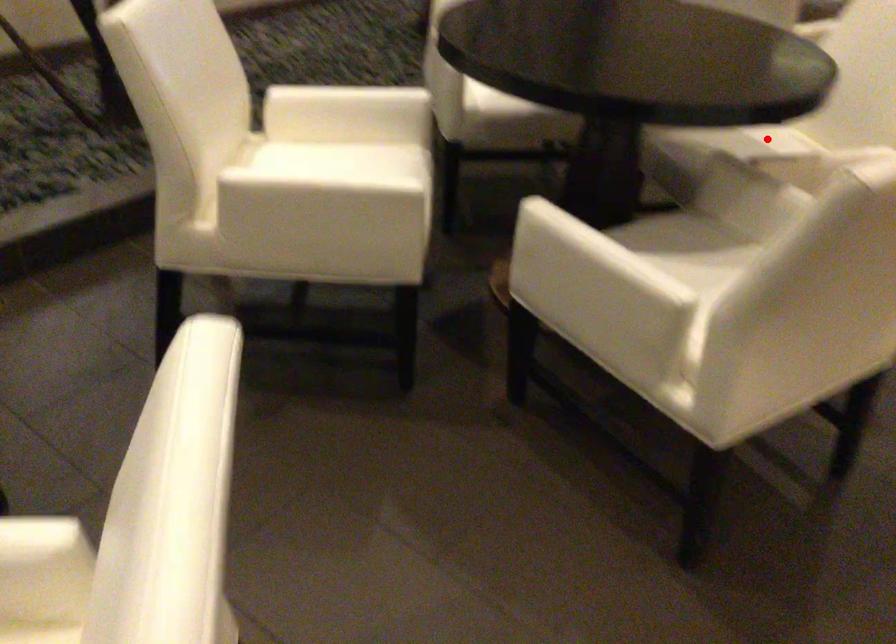
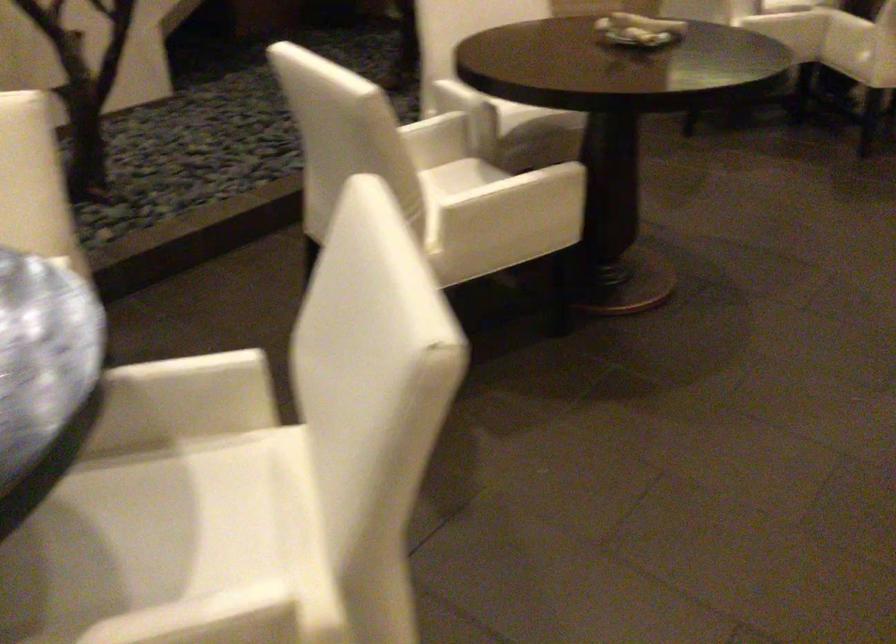
Locate, in the second image, the point that corresponds to the highlighted location in the first image.

(177, 514)